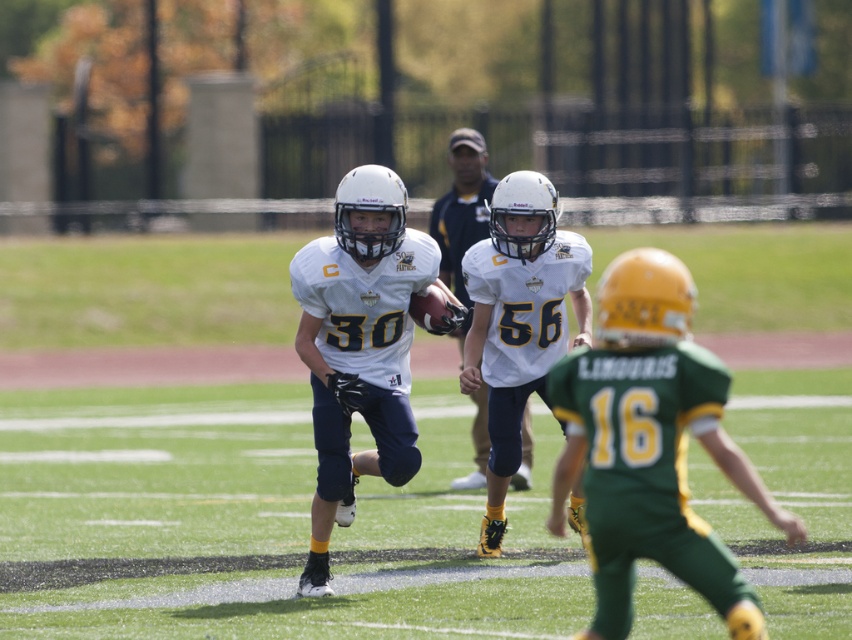
Does green/yellow jersey at center appear over white matte football helmet at center?

No, green/yellow jersey at center is not above white matte football helmet at center.

You are a GUI agent. You are given a task and a screenshot of the screen. Output one action in this format:
    pyautogui.click(x=<x>, y=<y>)
    Task: Click on the green/yellow jersey at center
    The height and width of the screenshot is (640, 852).
    Given the screenshot: What is the action you would take?
    pyautogui.click(x=649, y=444)

The height and width of the screenshot is (640, 852). Describe the element at coordinates (649, 444) in the screenshot. I see `green/yellow jersey at center` at that location.

What are the coordinates of `green/yellow jersey at center` in the screenshot? It's located at (649, 444).

Which of these two, green artificial turf at center or white matte football helmet at center, stands shorter?

With less height is white matte football helmet at center.

Measure the distance between green artificial turf at center and camera.

green artificial turf at center and camera are 29.50 feet apart from each other.

Where is `green artificial turf at center`? The width and height of the screenshot is (852, 640). green artificial turf at center is located at coordinates (254, 522).

In the scene shown: Is green artificial turf at center thinner than white matte helmet at center?

No.

Does green artificial turf at center lie in front of white matte helmet at center?

That is True.

Between point (273, 481) and point (522, 488), which one is positioned in front?

Point (522, 488) is in front.

This screenshot has width=852, height=640. I want to click on green artificial turf at center, so click(254, 522).